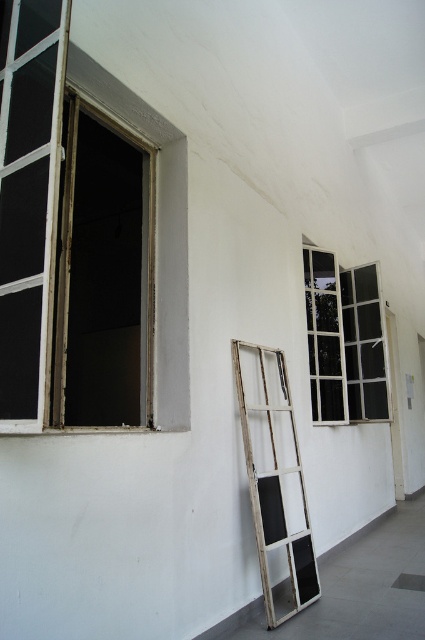
Is white wooden ladder at center above white glass window at center?

No.

Is point (241, 342) less distant than point (317, 378)?

Yes, point (241, 342) is closer to viewer.

Which is behind, point (261, 356) or point (342, 330)?

Point (342, 330)

Where is `white wooden ladder at center`? white wooden ladder at center is located at coordinates (274, 481).